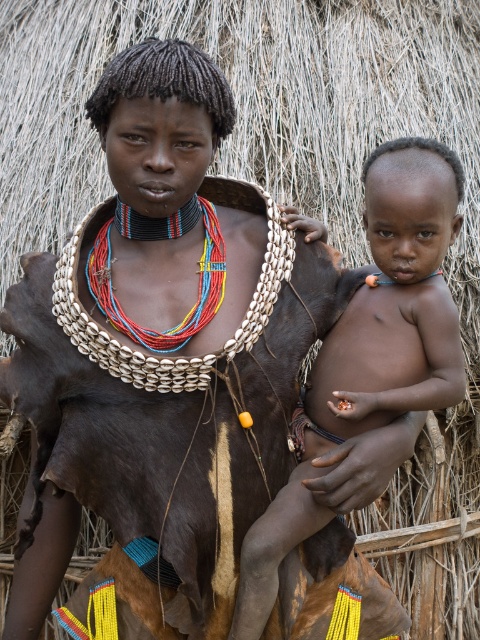
Question: Is matte skin baby at center above multicolored beaded necklace at center?

Choices:
 (A) no
 (B) yes

Answer: (A)

Question: Which point appears farthest from the camera in this image?

Choices:
 (A) (415, 172)
 (B) (213, 248)

Answer: (B)

Question: From the image, what is the correct spatial relationship of matte skin baby at center in relation to multicolored beaded necklace at center?

Choices:
 (A) left
 (B) right

Answer: (B)

Question: Is matte skin baby at center below multicolored beaded necklace at center?

Choices:
 (A) no
 (B) yes

Answer: (B)